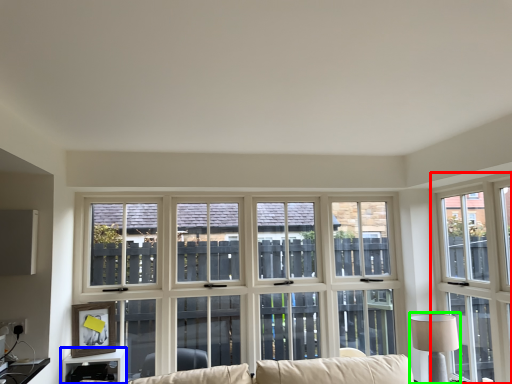
Question: Based on their relative distances, which object is nearer to window (highlighted by a red box)? Choose from table (highlighted by a blue box) and table lamp (highlighted by a green box).

Choices:
 (A) table
 (B) table lamp

Answer: (B)